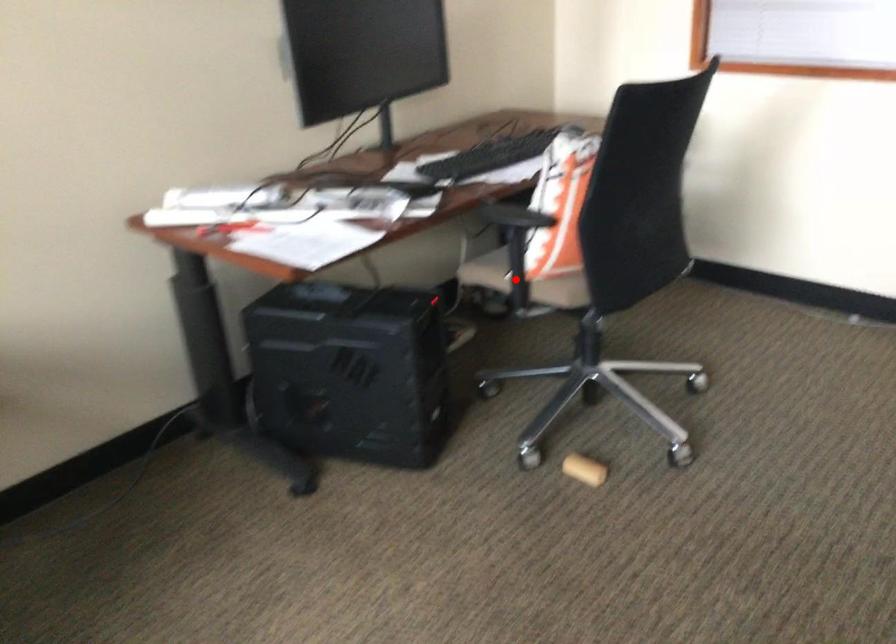
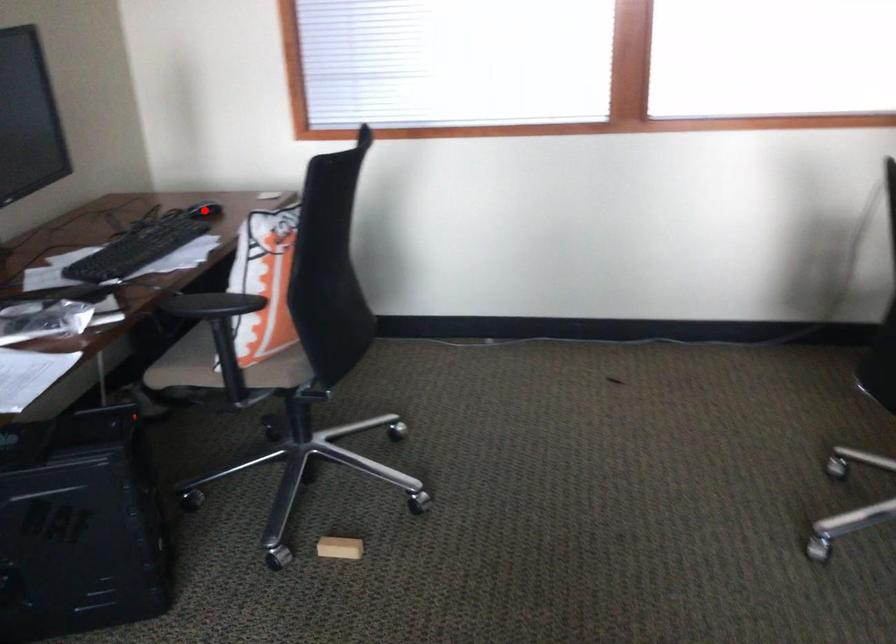
I am providing you with two images of the same scene from different viewpoints. A red point is marked on the first image and another point is marked on the second image. Is the red point in image1 aligned with the point shown in image2?

No